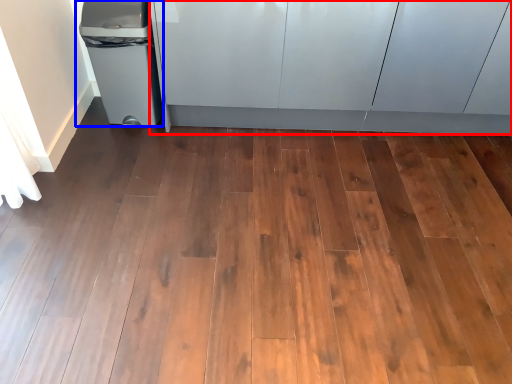
Question: Which object is further to the camera taking this photo, cabinetry (highlighted by a red box) or waste container (highlighted by a blue box)?

Choices:
 (A) cabinetry
 (B) waste container

Answer: (B)